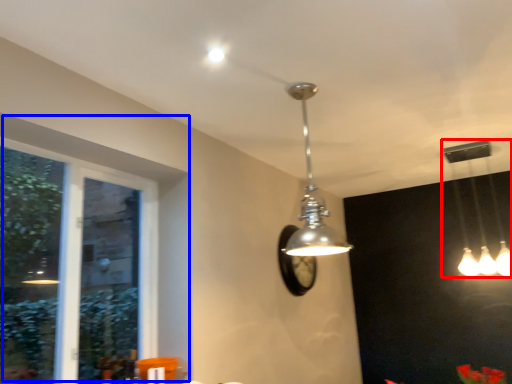
Question: Which object appears farthest to the camera in this image, lamp (highlighted by a red box) or window (highlighted by a blue box)?

Choices:
 (A) lamp
 (B) window

Answer: (A)